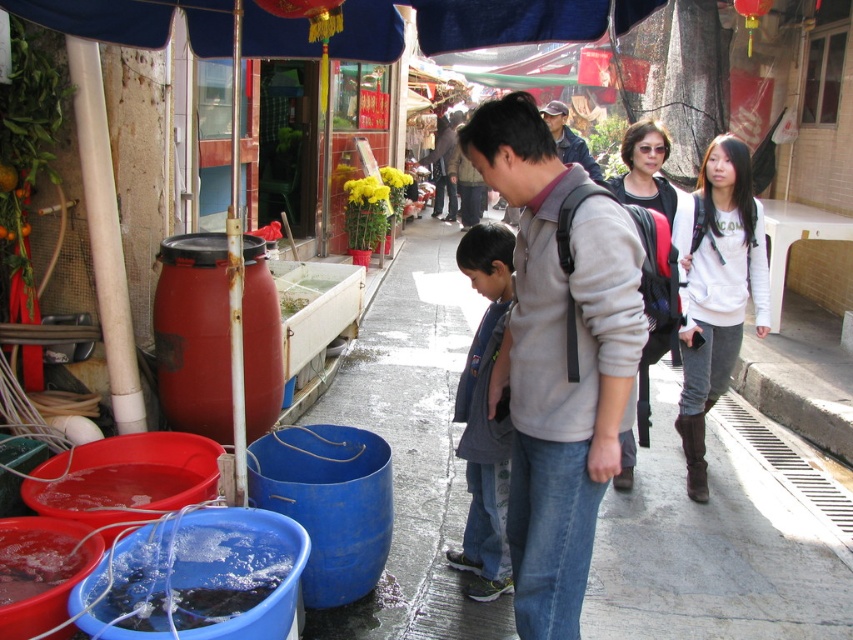
Can you confirm if gray fleece jacket at center is positioned below dark gray jacket at center?

No.

The width and height of the screenshot is (853, 640). What do you see at coordinates (558, 360) in the screenshot?
I see `gray fleece jacket at center` at bounding box center [558, 360].

The height and width of the screenshot is (640, 853). What do you see at coordinates (558, 360) in the screenshot?
I see `gray fleece jacket at center` at bounding box center [558, 360].

Where is `gray fleece jacket at center`? The image size is (853, 640). gray fleece jacket at center is located at coordinates (558, 360).

Does smooth concrete sidewalk at center have a larger size compared to dark gray jacket at center?

Actually, smooth concrete sidewalk at center might be smaller than dark gray jacket at center.

Which is above, smooth concrete sidewalk at center or dark gray jacket at center?

dark gray jacket at center

The width and height of the screenshot is (853, 640). What do you see at coordinates (711, 550) in the screenshot?
I see `smooth concrete sidewalk at center` at bounding box center [711, 550].

This screenshot has width=853, height=640. What are the coordinates of `smooth concrete sidewalk at center` in the screenshot? It's located at (711, 550).

Between smooth concrete sidewalk at center and denim jacket at center, which one appears on the left side from the viewer's perspective?

smooth concrete sidewalk at center

Can you confirm if smooth concrete sidewalk at center is positioned to the right of denim jacket at center?

In fact, smooth concrete sidewalk at center is to the left of denim jacket at center.

Who is more distant from viewer, (621, 556) or (590, 163)?

Positioned behind is point (590, 163).

This screenshot has height=640, width=853. I want to click on smooth concrete sidewalk at center, so click(x=711, y=550).